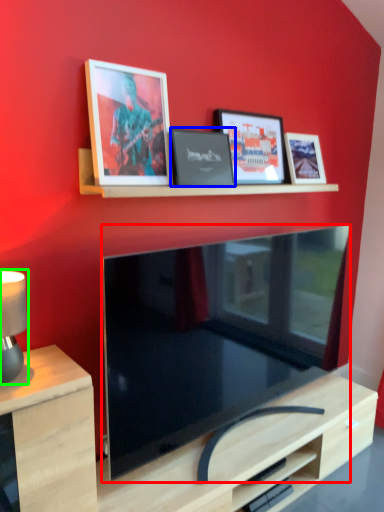
Question: Which object is positioned closest to television (highlighted by a red box)? Select from picture frame (highlighted by a blue box) and table lamp (highlighted by a green box).

Choices:
 (A) picture frame
 (B) table lamp

Answer: (A)